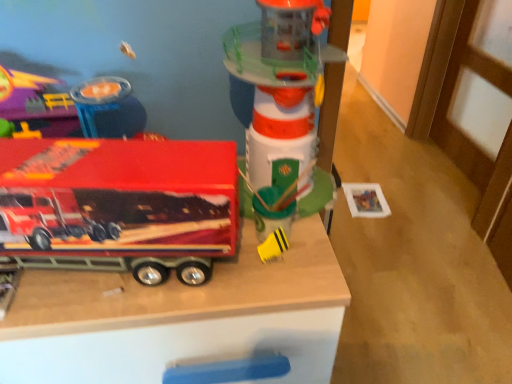
At what (x,y) coordinates should I click in order to perform the action: click on empty space that is ontop of metallic red truck at left, the third toy positioned from the right. Please return your answer as a coordinate pair (x, y). Looking at the image, I should click on (98, 162).